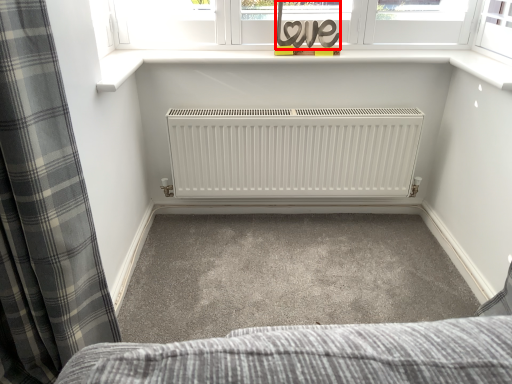
Question: From the image's perspective, what is the correct spatial relationship of writing (annotated by the red box) in relation to curtain?

Choices:
 (A) above
 (B) below

Answer: (A)